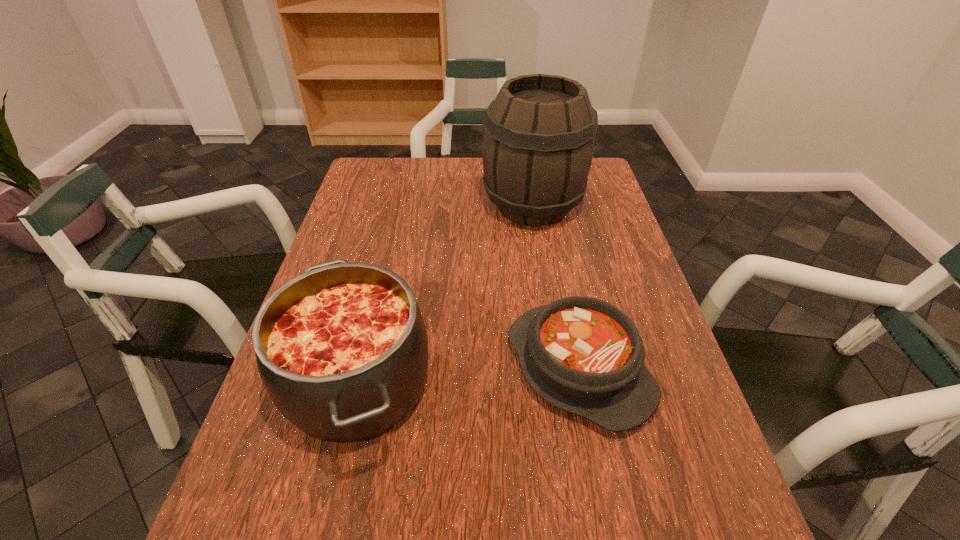
Locate an element on the screen. vacant space that satisfies the following two spatial constraints: 1. on the back side of the tallest object; 2. on the left side of the leftmost object is located at coordinates (399, 206).